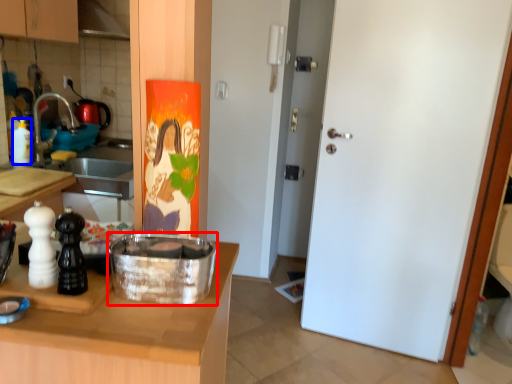
Question: Which of the following is the closest to the observer, kitchen appliance (highlighted by a red box) or bottle (highlighted by a blue box)?

Choices:
 (A) kitchen appliance
 (B) bottle

Answer: (A)